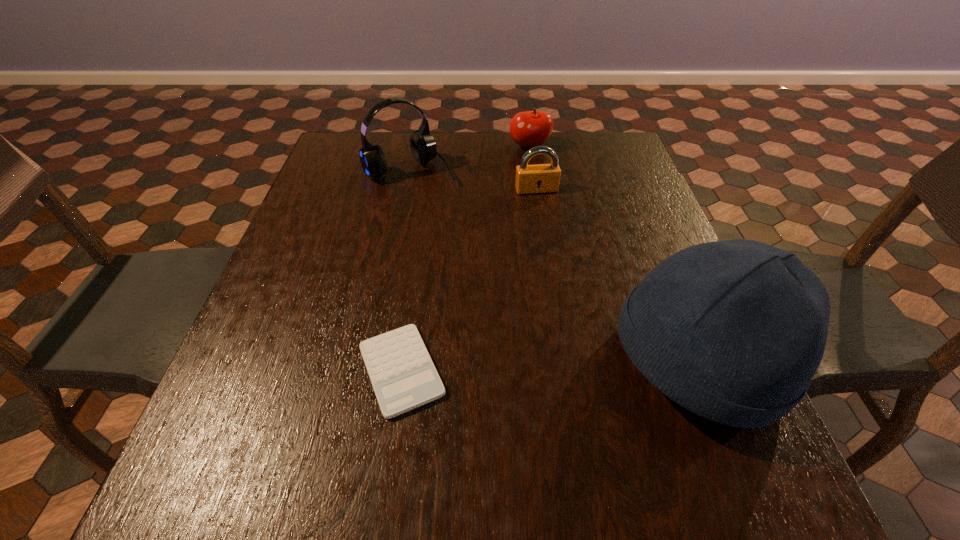
In order to click on vacant position located to unlock the padlock from the front in this screenshot , I will do `click(575, 301)`.

The width and height of the screenshot is (960, 540). In order to click on free space located on the ear cushions of the second tallest object in this screenshot , I will do `click(477, 238)`.

Locate an element on the screen. Image resolution: width=960 pixels, height=540 pixels. vacant space positioned 0.120m on the ear cushions of the second tallest object is located at coordinates (452, 209).

Find the location of `vacant space located 0.060m on the ear cushions of the second tallest object`. vacant space located 0.060m on the ear cushions of the second tallest object is located at coordinates (442, 197).

In order to click on free spot located 0.190m on the stem of the apple in this screenshot , I will do `click(533, 192)`.

Identify the location of free space located 0.080m on the stem of the apple. (532, 170).

This screenshot has height=540, width=960. I want to click on vacant space situated on the stem of the apple, so click(535, 208).

I want to click on headset that is at the far edge, so click(x=423, y=147).

The width and height of the screenshot is (960, 540). Identify the location of apple present at the far edge. click(x=533, y=128).

This screenshot has width=960, height=540. In order to click on calculator located in the near edge section of the desktop in this screenshot , I will do `click(403, 376)`.